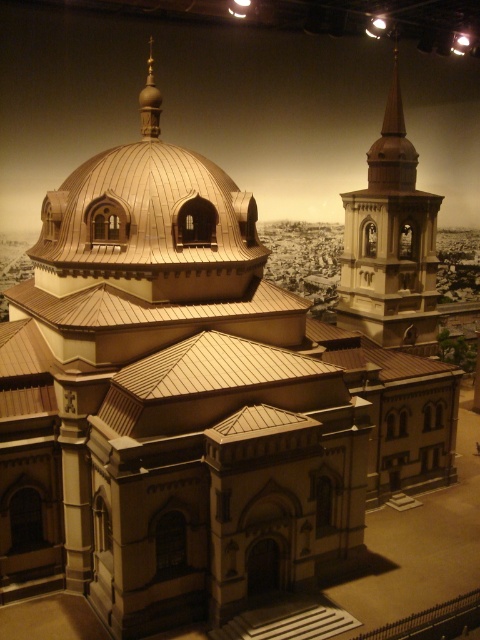
Measure the distance between gold textured spire at upper right and gold polished dome at upper center.

The distance of gold textured spire at upper right from gold polished dome at upper center is 27.55 meters.

Based on the photo, does gold textured spire at upper right have a lesser width compared to gold polished dome at upper center?

No, gold textured spire at upper right is not thinner than gold polished dome at upper center.

Does point (424, 198) come farther from viewer compared to point (147, 72)?

No.

What are the coordinates of `gold textured spire at upper right` in the screenshot? It's located at (391, 243).